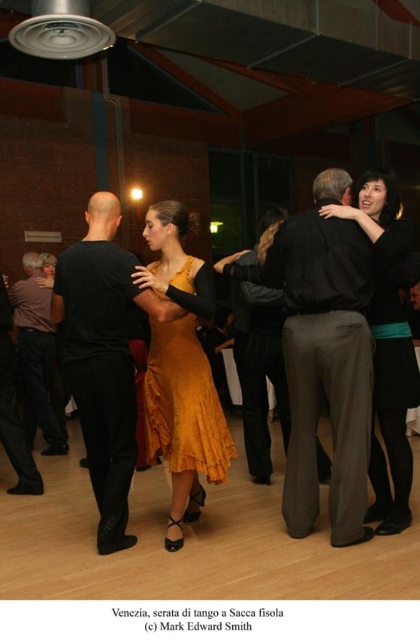
What object is located at the coordinate point (333, 344) in the image?

The point (333, 344) corresponds to the matte gold dress at center.

You are a photographer at the event and want to capture a photo of both the matte black dress at right and the velvet gold dress at center. However, you need to position yourself so that neither dress is blocking the other. Where should you stand to ensure both dresses are fully visible?

To ensure both the matte black dress at right and the velvet gold dress at center are fully visible without obstruction, position yourself behind the matte black dress at right. Since it is in front of the velvet gold dress at center, standing behind it will allow you to see both dresses clearly.

What is located at the coordinates point (183, 403) in the image?

The point (183, 403) is located on the velvet gold dress at center.